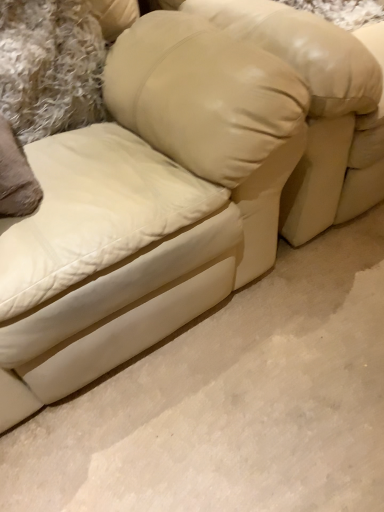
What do you see at coordinates (321, 108) in the screenshot? I see `beige leather bean bag chair at center` at bounding box center [321, 108].

What is the approximate width of beige leather bean bag chair at center?

beige leather bean bag chair at center is 39.32 inches in width.

What is the approximate height of beige leather bean bag chair at center?

beige leather bean bag chair at center is 31.36 inches tall.

Find the location of a particular element. This screenshot has height=512, width=384. beige leather bean bag chair at center is located at coordinates (321, 108).

What do you see at coordinates (50, 66) in the screenshot? I see `beige leather pillow at upper center` at bounding box center [50, 66].

At what (x,y) coordinates should I click in order to perform the action: click on beige leather pillow at upper center. Please return your answer as a coordinate pair (x, y). The width and height of the screenshot is (384, 512). Looking at the image, I should click on (50, 66).

From the picture: In order to face beige leather pillow at upper center, should I rotate leftwards or rightwards?

To face it directly, rotate left by 19.245 degrees.

At what (x,y) coordinates should I click in order to perform the action: click on beige leather bean bag chair at center. Please return your answer as a coordinate pair (x, y). The height and width of the screenshot is (512, 384). Looking at the image, I should click on [x=321, y=108].

Consider the image. Can you confirm if beige leather bean bag chair at center is positioned to the right of beige leather pillow at upper center?

Yes.

Which object is further away from the camera, beige leather bean bag chair at center or beige leather pillow at upper center?

beige leather pillow at upper center is further away from the camera.

Is point (353, 182) farther from viewer compared to point (73, 127)?

Yes, point (353, 182) is farther from viewer.

From the image's perspective, is beige leather bean bag chair at center above beige leather pillow at upper center?

Yes, from the image's perspective, beige leather bean bag chair at center is over beige leather pillow at upper center.

From a real-world perspective, relative to beige leather pillow at upper center, is beige leather bean bag chair at center vertically above or below?

In terms of real-world spatial position, beige leather bean bag chair at center is below beige leather pillow at upper center.

Which object is wider, beige leather bean bag chair at center or beige leather pillow at upper center?

Wider between the two is beige leather bean bag chair at center.

Which of these two, beige leather bean bag chair at center or beige leather pillow at upper center, stands taller?

beige leather bean bag chair at center is taller.

Considering the relative sizes of beige leather bean bag chair at center and beige leather pillow at upper center in the image provided, is beige leather bean bag chair at center bigger than beige leather pillow at upper center?

Indeed, beige leather bean bag chair at center has a larger size compared to beige leather pillow at upper center.

Which is correct: beige leather bean bag chair at center is inside beige leather pillow at upper center, or outside of it?

beige leather bean bag chair at center is not inside beige leather pillow at upper center, it's outside.

Is beige leather bean bag chair at center beside beige leather pillow at upper center?

beige leather bean bag chair at center and beige leather pillow at upper center are clearly separated.

From the picture: Is beige leather bean bag chair at center oriented towards beige leather pillow at upper center?

No, beige leather bean bag chair at center is not facing towards beige leather pillow at upper center.

Measure the distance from beige leather bean bag chair at center to beige leather pillow at upper center.

A distance of 20.31 inches exists between beige leather bean bag chair at center and beige leather pillow at upper center.

Where is `bean bag chair that is on the right side of beige leather pillow at upper center`? This screenshot has width=384, height=512. bean bag chair that is on the right side of beige leather pillow at upper center is located at coordinates (321, 108).

Does beige leather pillow at upper center appear on the left side of beige leather bean bag chair at center?

Yes, beige leather pillow at upper center is to the left of beige leather bean bag chair at center.

Relative to beige leather bean bag chair at center, is beige leather pillow at upper center in front or behind?

Clearly, beige leather pillow at upper center is behind beige leather bean bag chair at center.

Does point (98, 37) appear closer or farther from the camera than point (237, 23)?

Clearly, point (98, 37) is more distant from the camera than point (237, 23).

From the image's perspective, is beige leather pillow at upper center located above or below beige leather bean bag chair at center?

Based on their image positions, beige leather pillow at upper center is located beneath beige leather bean bag chair at center.

From a real-world perspective, is beige leather pillow at upper center physically below beige leather bean bag chair at center?

Incorrect, from a real-world perspective, beige leather pillow at upper center is higher than beige leather bean bag chair at center.

Does beige leather pillow at upper center have a greater width compared to beige leather bean bag chair at center?

No, beige leather pillow at upper center is not wider than beige leather bean bag chair at center.

Is beige leather pillow at upper center shorter than beige leather bean bag chair at center?

Yes, beige leather pillow at upper center is shorter than beige leather bean bag chair at center.

Is beige leather pillow at upper center bigger than beige leather bean bag chair at center?

Actually, beige leather pillow at upper center might be smaller than beige leather bean bag chair at center.

Would you say beige leather pillow at upper center contains beige leather bean bag chair at center?

That's incorrect, beige leather bean bag chair at center is not inside beige leather pillow at upper center.

Is the surface of beige leather pillow at upper center in direct contact with beige leather bean bag chair at center?

No, beige leather pillow at upper center is not in contact with beige leather bean bag chair at center.

Could you tell me if beige leather pillow at upper center is turned towards beige leather bean bag chair at center?

No, beige leather pillow at upper center is not turned towards beige leather bean bag chair at center.

How distant is beige leather pillow at upper center from beige leather bean bag chair at center?

beige leather pillow at upper center is 20.31 inches from beige leather bean bag chair at center.

At what (x,y) coordinates should I click in order to perform the action: click on pillow on the left of beige leather bean bag chair at center. Please return your answer as a coordinate pair (x, y). This screenshot has height=512, width=384. Looking at the image, I should click on (50, 66).

Identify the location of pillow above the beige leather bean bag chair at center (from a real-world perspective). Image resolution: width=384 pixels, height=512 pixels. (50, 66).

Where is `pillow that appears on the left of beige leather bean bag chair at center`? This screenshot has width=384, height=512. pillow that appears on the left of beige leather bean bag chair at center is located at coordinates (50, 66).